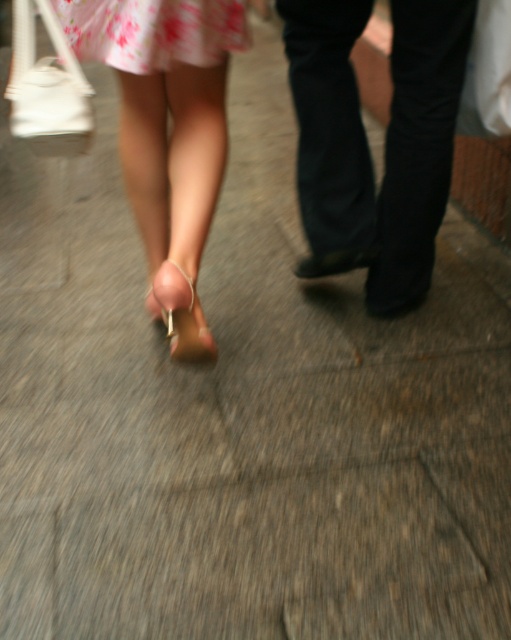
You are standing in front of the image and want to touch the points shown. Which of the two points, point (236, 36) or point (309, 268), would feel closer to your hand when reaching out?

Point (236, 36) is closer to the camera than point (309, 268), so when reaching out, point (236, 36) would feel closer to your hand.

You are a photographer trying to capture the scene. The black leather pants at center and the pink floral fabric dress at upper left are in your viewfinder. Which object occupies more horizontal space in the frame?

The black leather pants at center occupies more horizontal space in the frame because its width surpasses that of the pink floral fabric dress at upper left.

In the scene shown: You are a photographer trying to capture the scene. You need to adjust your camera to focus on both the pink floral fabric dress at upper left and the black leather shoe at center. Considering their sizes, which object should you prioritize focusing on first to ensure it is in sharp detail?

The black leather shoe at center should be prioritized for sharp focus first because its smaller size compared to the pink floral fabric dress at upper left requires precise adjustment to capture details clearly.